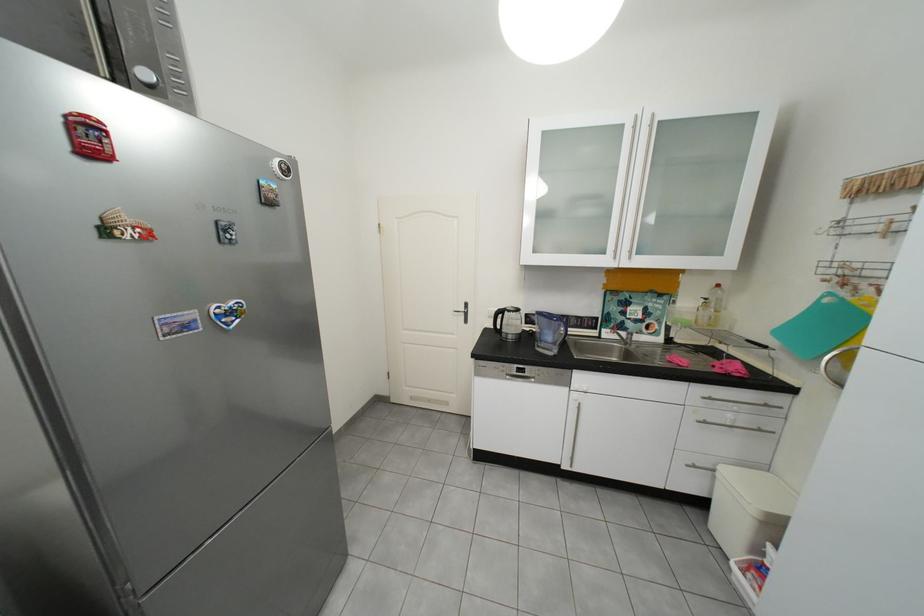
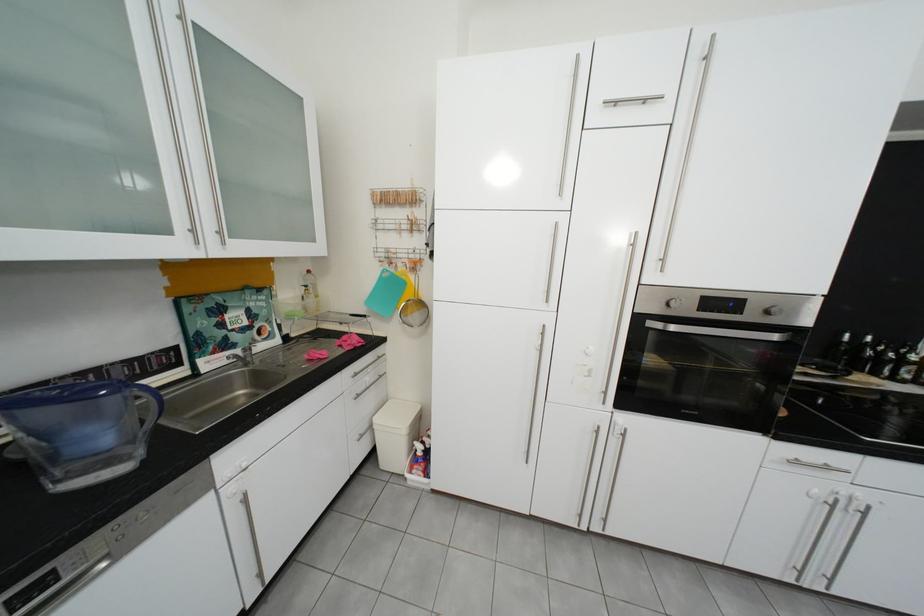
Where in the second image is the point corresponding to [869,267] from the first image?

(406, 252)